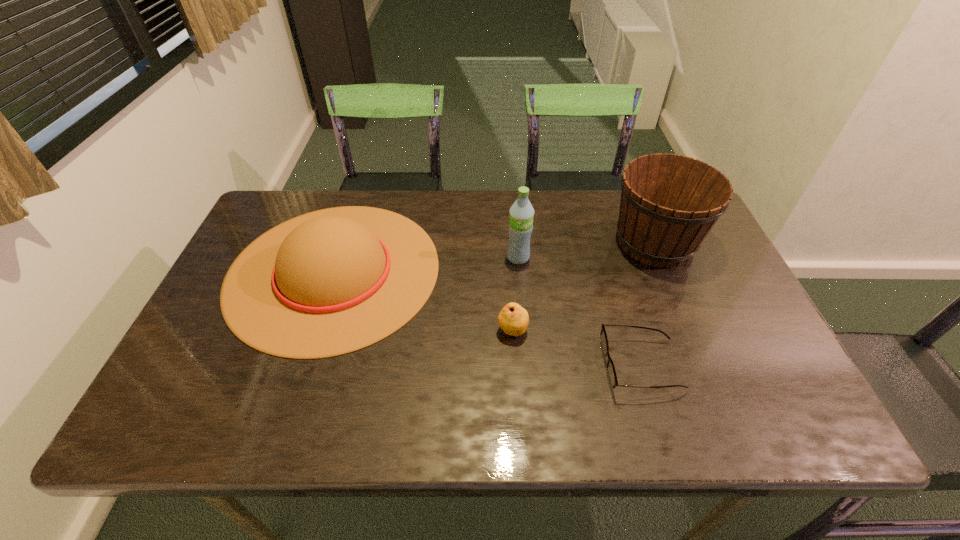
Find the location of a particular element. Image resolution: width=960 pixels, height=540 pixels. free spot between the second shortest object and the water bottle is located at coordinates (516, 294).

Image resolution: width=960 pixels, height=540 pixels. Identify the location of vacant space in between the second shortest object and the shortest object. (577, 348).

Find the location of a particular element. Image resolution: width=960 pixels, height=540 pixels. unoccupied area between the wine bucket and the water bottle is located at coordinates (587, 249).

You are a GUI agent. You are given a task and a screenshot of the screen. Output one action in this format:
    pyautogui.click(x=<x>, y=<y>)
    Task: Click on the fourth closest object relative to the spectacles
    This screenshot has width=960, height=540.
    Given the screenshot: What is the action you would take?
    pyautogui.click(x=330, y=282)

Where is `object that is the fourth closest to the pear`? The image size is (960, 540). object that is the fourth closest to the pear is located at coordinates (x=669, y=203).

The height and width of the screenshot is (540, 960). Identify the location of vacant space that satisfies the following two spatial constraints: 1. on the front side of the pear; 2. on the left side of the third tallest object. (314, 330).

This screenshot has width=960, height=540. I want to click on free space that satisfies the following two spatial constraints: 1. on the back side of the wine bucket; 2. on the right side of the water bottle, so click(516, 242).